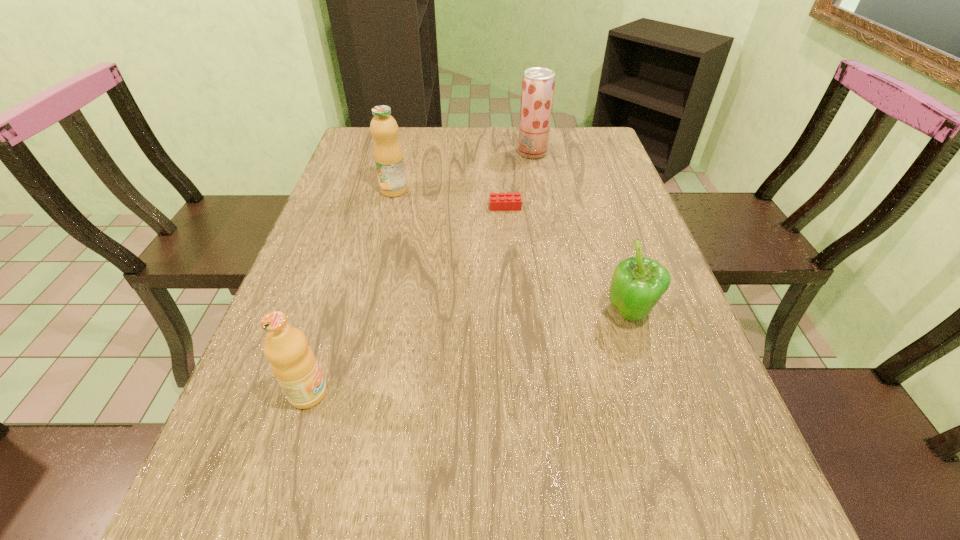
I want to click on the rightmost fruit juice, so click(538, 83).

Where is `the fourth object from left to right`? This screenshot has height=540, width=960. the fourth object from left to right is located at coordinates (538, 83).

The width and height of the screenshot is (960, 540). I want to click on the fourth nearest object, so click(388, 156).

You are a GUI agent. You are given a task and a screenshot of the screen. Output one action in this format:
    pyautogui.click(x=<x>, y=<y>)
    Task: Click on the shortest fruit juice
    
    Given the screenshot: What is the action you would take?
    pyautogui.click(x=293, y=363)

At what (x,y) coordinates should I click in order to perform the action: click on the nearest fruit juice. Please return your answer as a coordinate pair (x, y). Looking at the image, I should click on (293, 363).

Locate an element on the screen. the fourth farthest object is located at coordinates (637, 284).

Find the location of a particular element. The image size is (960, 540). bell pepper is located at coordinates (637, 284).

This screenshot has width=960, height=540. Find the location of `the shortest object`. the shortest object is located at coordinates (501, 201).

The height and width of the screenshot is (540, 960). I want to click on Lego, so click(x=501, y=201).

The height and width of the screenshot is (540, 960). In order to click on free space located on the left of the farthest object in this screenshot , I will do `click(434, 153)`.